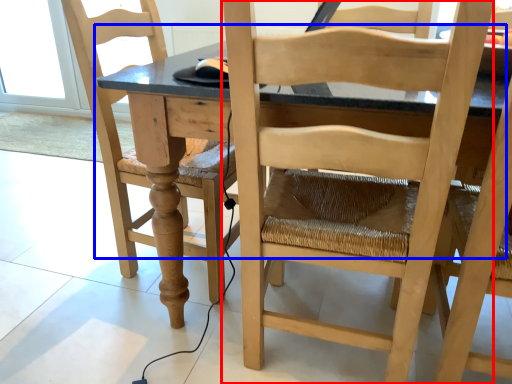
Question: Among these objects, which one is nearest to the camera, chair (highlighted by a red box) or table (highlighted by a blue box)?

Choices:
 (A) chair
 (B) table

Answer: (A)